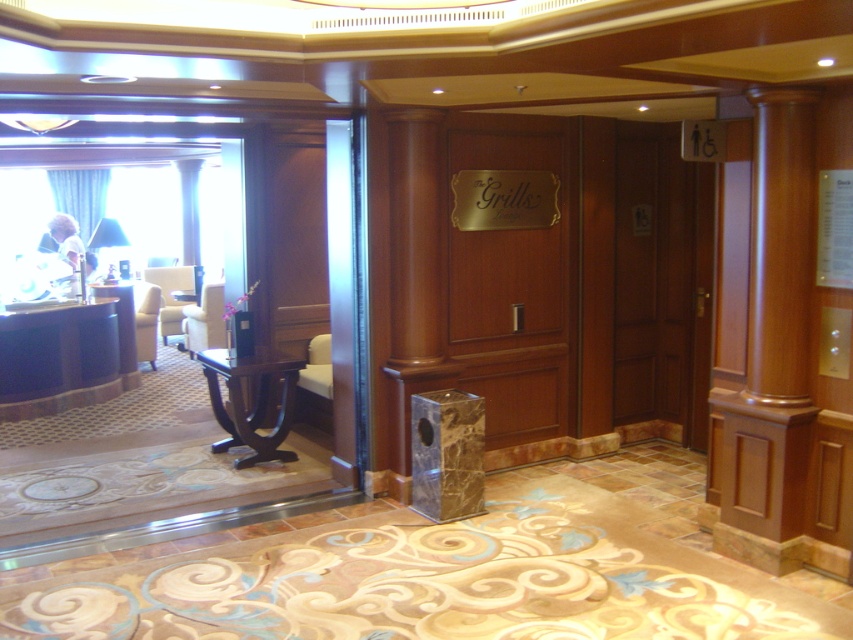
You are a guest at this luxurious space and need to reach the elevator. You see the wooden elevator at center and the wooden column at right. Which object is bigger?

The wooden elevator at center is larger in size compared to the wooden column at right.

You are a guest at this luxurious space and need to determine if your large luggage can fit through the space between the wooden elevator at center and the wooden column at right. Based on their widths, can you confirm if there is enough space?

The wooden elevator at center is wider than the wooden column at right. Since the elevator is wider, the space between them might be sufficient for your luggage, but the exact clearance depends on the specific dimensions of both objects. However, according to the description, the elevator is wider, so there might be enough space.